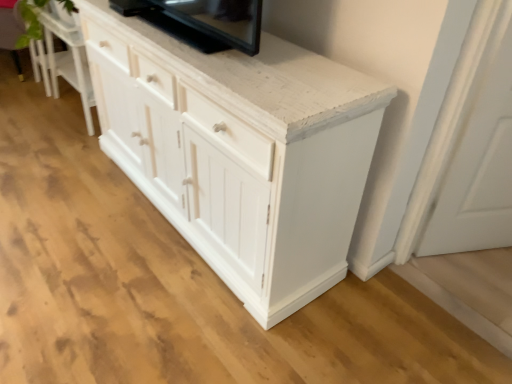
Image resolution: width=512 pixels, height=384 pixels. I want to click on empty space that is ontop of white painted wood cabinet at center (from a real-world perspective), so click(x=77, y=195).